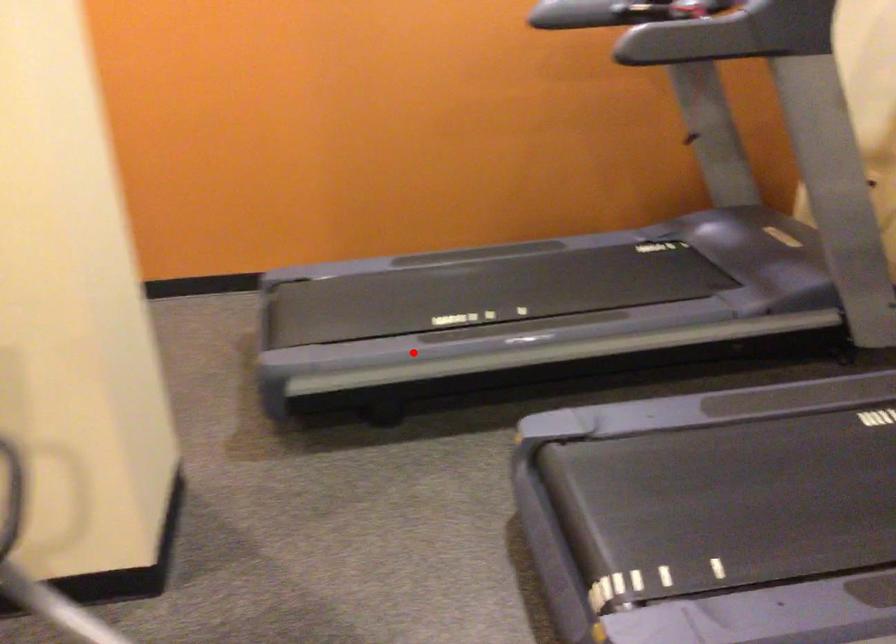
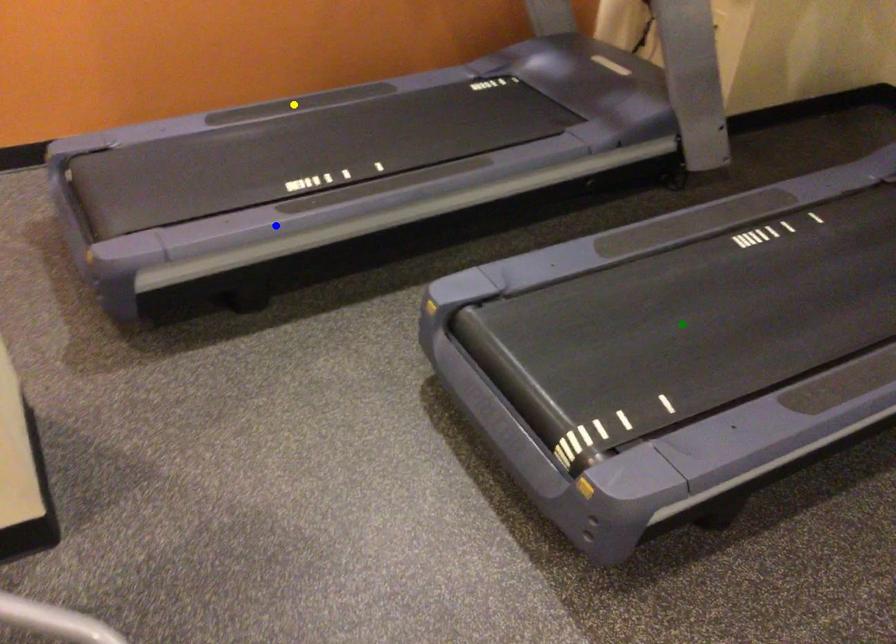
Question: I am providing you with two images of the same scene from different viewpoints. A red point is marked on the first image. You are given multiple points on the second image. Which spot in image 2 lines up with the point in image 1?

Choices:
 (A) yellow point
 (B) green point
 (C) blue point

Answer: (C)